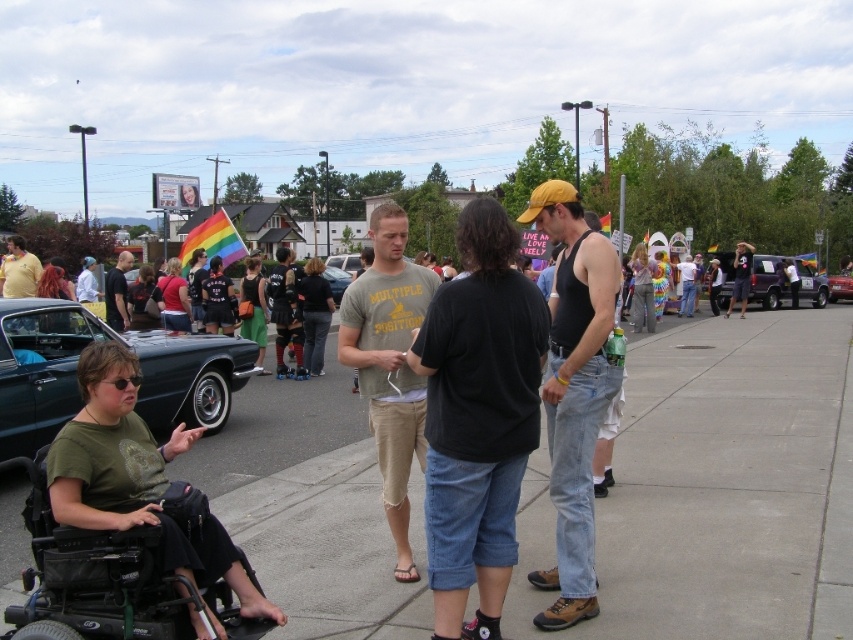
You are a photographer at the event and want to capture a photo that includes both the black plastic wheelchair at lower left and the matte green shirt at lower left. Based on their positions, which object should be placed on the right side of the other in the photo?

The black plastic wheelchair at lower left is positioned on the right side of matte green shirt at lower left, so in the photo, the wheelchair should be on the right side of the matte green shirt at lower left.

You are a photographer at the event and want to capture a photo that includes both the black plastic wheelchair at lower left and the matte green shirt at lower left. Based on their positions, will the wheelchair block the view of the matte green shirt in the photo?

The black plastic wheelchair at lower left is in front of the matte green shirt at lower left, so the wheelchair will block the view of the matte green shirt in the photo.